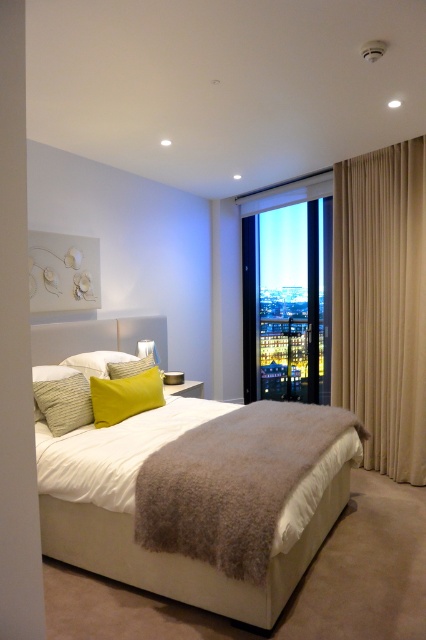
Question: Can you confirm if white soft bed at center is smaller than yellow fabric pillow at upper left?

Choices:
 (A) no
 (B) yes

Answer: (A)

Question: Does beige fabric curtain at right have a lesser width compared to yellow fabric pillow at upper left?

Choices:
 (A) yes
 (B) no

Answer: (B)

Question: Which of the following is the farthest from the observer?

Choices:
 (A) (198, 572)
 (B) (388, 272)
 (C) (140, 381)

Answer: (B)

Question: Which object is closer to the camera taking this photo?

Choices:
 (A) transparent glass door at center
 (B) white soft bed at center

Answer: (B)

Question: Does transparent glass door at center have a lesser width compared to yellow fabric pillow at center?

Choices:
 (A) yes
 (B) no

Answer: (B)

Question: Which point is closer to the camera?

Choices:
 (A) transparent glass door at center
 (B) yellow fabric pillow at center
 (C) white soft bed at center
 (D) yellow fabric pillow at upper left

Answer: (C)